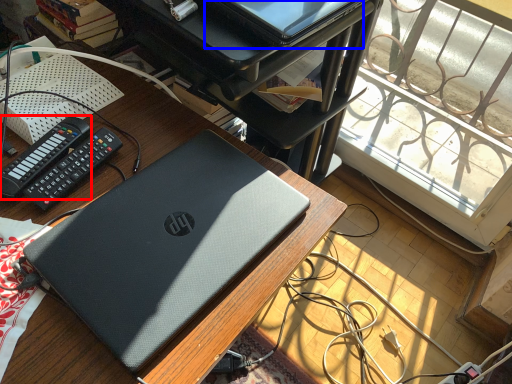
Question: Which point is closer to the camera, control (highlighted by a red box) or computer (highlighted by a blue box)?

Choices:
 (A) control
 (B) computer

Answer: (A)